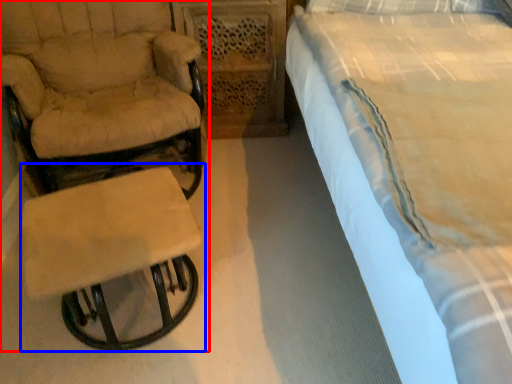
Question: Which object is closer to the camera taking this photo, chair (highlighted by a red box) or table (highlighted by a blue box)?

Choices:
 (A) chair
 (B) table

Answer: (B)